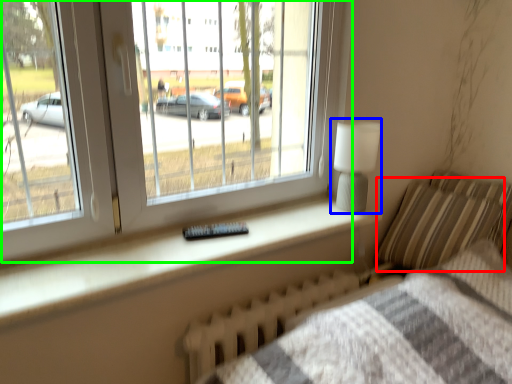
Question: Which is farther away from pillow (highlighted by a red box)? table lamp (highlighted by a blue box) or window (highlighted by a green box)?

Choices:
 (A) table lamp
 (B) window

Answer: (B)